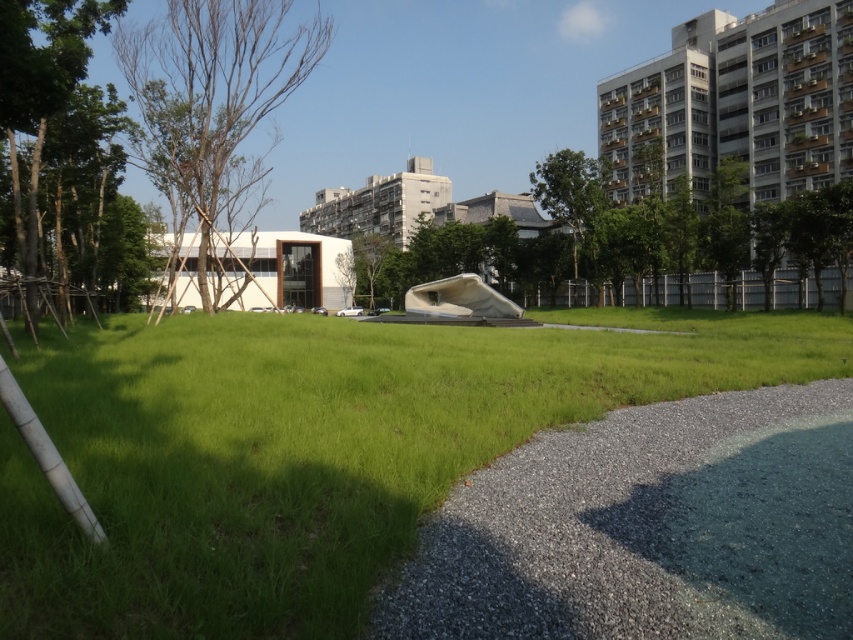
Question: Is brown wood tree at left positioned before green leafy tree at left?

Choices:
 (A) no
 (B) yes

Answer: (A)

Question: Can you confirm if green leafy tree at center is positioned to the left of green leafy tree at left?

Choices:
 (A) no
 (B) yes

Answer: (A)

Question: Does brown wood tree at left appear on the right side of green leafy tree at upper right?

Choices:
 (A) no
 (B) yes

Answer: (A)

Question: Which object appears closest to the camera in this image?

Choices:
 (A) brown wood tree at left
 (B) green grass at center
 (C) green leafy tree at left

Answer: (B)

Question: Which of the following is the farthest from the observer?

Choices:
 (A) green leafy tree at left
 (B) green grass at center

Answer: (A)

Question: Among these points, which one is nearest to the camera?

Choices:
 (A) (271, 102)
 (B) (824, 252)
 (C) (740, 582)

Answer: (C)